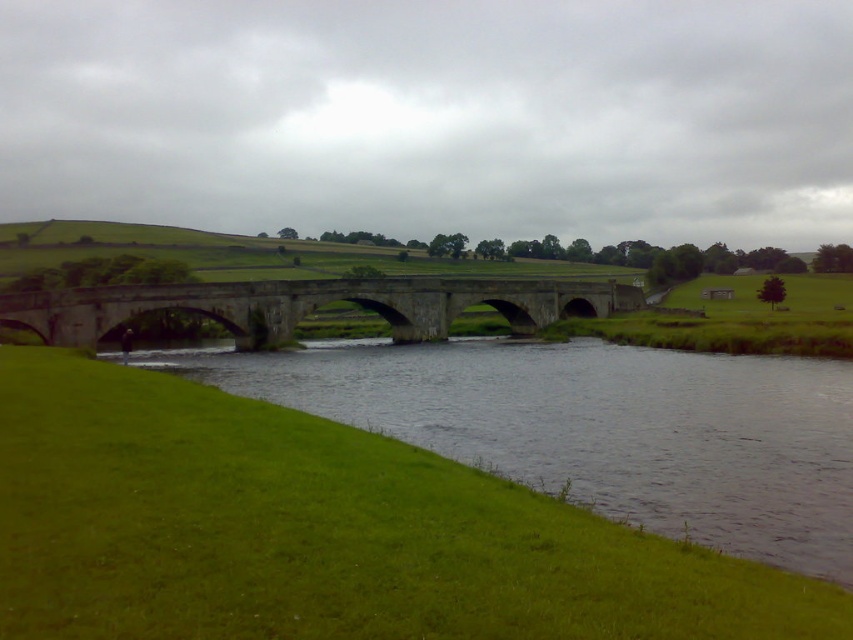
Question: Observing the image, what is the correct spatial positioning of green grassy river at lower left in reference to stone bridge at center?

Choices:
 (A) below
 (B) above

Answer: (A)

Question: Is green grassy river at lower left behind stone bridge at center?

Choices:
 (A) yes
 (B) no

Answer: (B)

Question: Can you confirm if green grassy river at lower left is positioned above stone bridge at center?

Choices:
 (A) no
 (B) yes

Answer: (A)

Question: Which of the following is the closest to the observer?

Choices:
 (A) tap(207, 369)
 (B) tap(532, 310)

Answer: (A)

Question: Which point is closer to the camera?

Choices:
 (A) (231, 285)
 (B) (508, 381)

Answer: (B)

Question: Which point is farther from the camera taking this photo?

Choices:
 (A) (714, 401)
 (B) (582, 291)

Answer: (B)